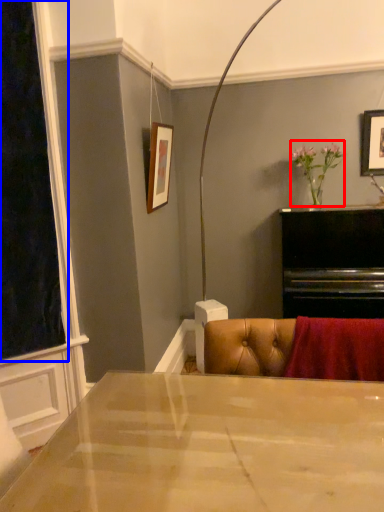
Question: Which point is further to the camera, floral arrangement (highlighted by a red box) or window screen (highlighted by a blue box)?

Choices:
 (A) floral arrangement
 (B) window screen

Answer: (A)